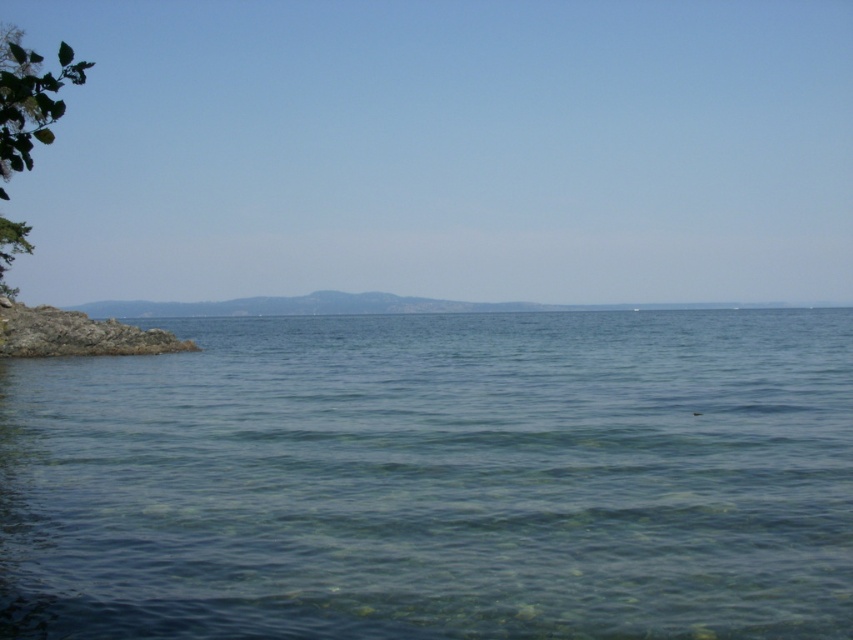
Question: Considering the relative positions of clear water at left and rocky shore at lower left in the image provided, where is clear water at left located with respect to rocky shore at lower left?

Choices:
 (A) left
 (B) right

Answer: (B)

Question: Observing the image, what is the correct spatial positioning of clear water at left in reference to rocky shore at lower left?

Choices:
 (A) left
 (B) right

Answer: (B)

Question: Can you confirm if clear water at left is wider than rocky shore at lower left?

Choices:
 (A) yes
 (B) no

Answer: (A)

Question: Among these points, which one is nearest to the camera?

Choices:
 (A) (711, 392)
 (B) (48, 326)

Answer: (A)